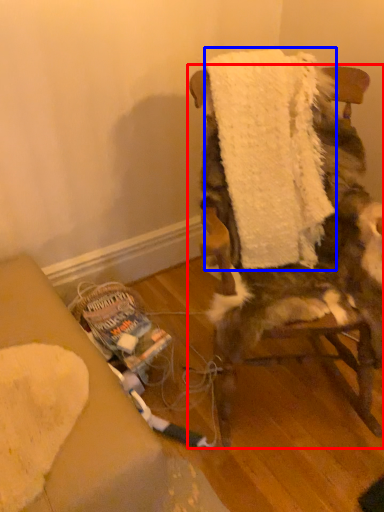
Question: Which object appears closest to the camera in this image, chair (highlighted by a red box) or bath towel (highlighted by a blue box)?

Choices:
 (A) chair
 (B) bath towel

Answer: (A)